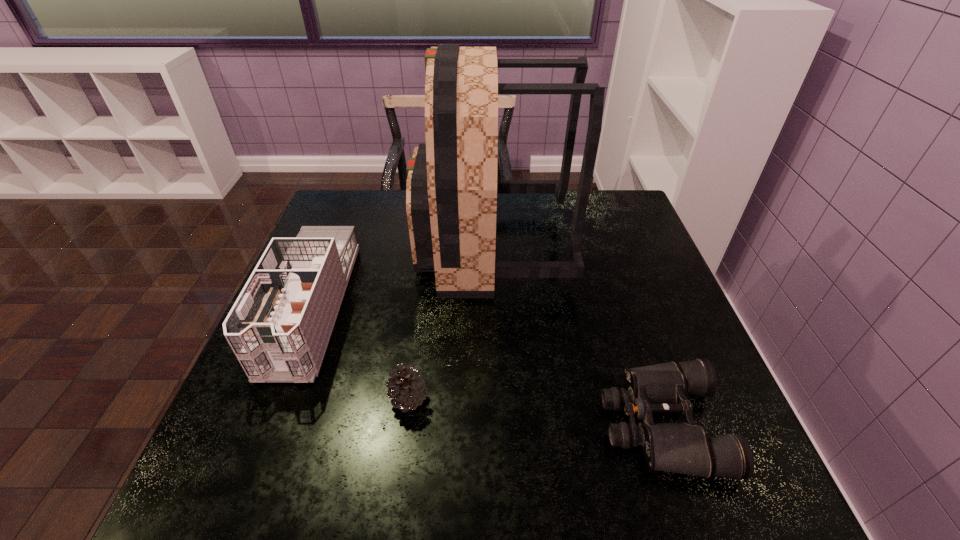
Locate an element on the screen. free space between the third tallest object and the tallest object is located at coordinates (450, 322).

Where is `vacant space that is in between the binoculars and the second shortest object`? vacant space that is in between the binoculars and the second shortest object is located at coordinates (535, 412).

You are a GUI agent. You are given a task and a screenshot of the screen. Output one action in this format:
    pyautogui.click(x=<x>, y=<y>)
    Task: Click on the vacant point located between the leftmost object and the backpack
    This screenshot has width=960, height=540.
    Given the screenshot: What is the action you would take?
    pyautogui.click(x=401, y=276)

At what (x,y) coordinates should I click in order to perform the action: click on the second closest object to the second shortest object. Please return your answer as a coordinate pair (x, y). Looking at the image, I should click on coord(451,190).

Locate which object ranks second in proximity to the backpack. Please provide its 2D coordinates. Your answer should be formatted as a tuple, i.e. [(x, y)], where the tuple contains the x and y coordinates of a point satisfying the conditions above.

[(685, 448)]

Image resolution: width=960 pixels, height=540 pixels. Find the location of `vacant area that satisfies the following two spatial constraints: 1. at the entrance of the second shortest object; 2. on the left side of the third shortest object`. vacant area that satisfies the following two spatial constraints: 1. at the entrance of the second shortest object; 2. on the left side of the third shortest object is located at coordinates (275, 399).

Find the location of a particular element. The width and height of the screenshot is (960, 540). blank space that satisfies the following two spatial constraints: 1. on the front face of the backpack; 2. at the entrance of the leftmost object is located at coordinates click(x=494, y=307).

You are a GUI agent. You are given a task and a screenshot of the screen. Output one action in this format:
    pyautogui.click(x=<x>, y=<y>)
    Task: Click on the blank area in the image that satisfies the following two spatial constraints: 1. at the entrance of the pinecone; 2. on the right side of the dollhouse
    
    Given the screenshot: What is the action you would take?
    pyautogui.click(x=275, y=399)

At what (x,y) coordinates should I click in order to perform the action: click on free space that satisfies the following two spatial constraints: 1. on the front face of the backpack; 2. at the entrance of the leftmost object. Please return your answer as a coordinate pair (x, y). Looking at the image, I should click on (494, 307).